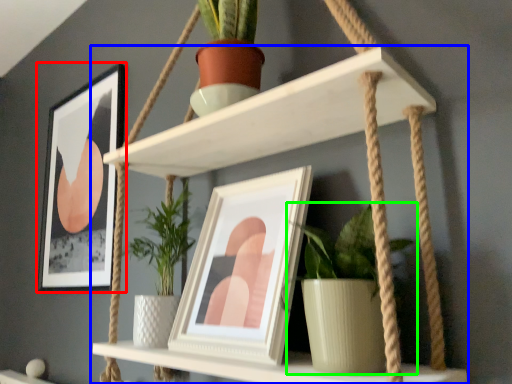
Question: Which is farther away from picture frame (highlighted by a red box)? shelf (highlighted by a blue box) or houseplant (highlighted by a green box)?

Choices:
 (A) shelf
 (B) houseplant

Answer: (B)